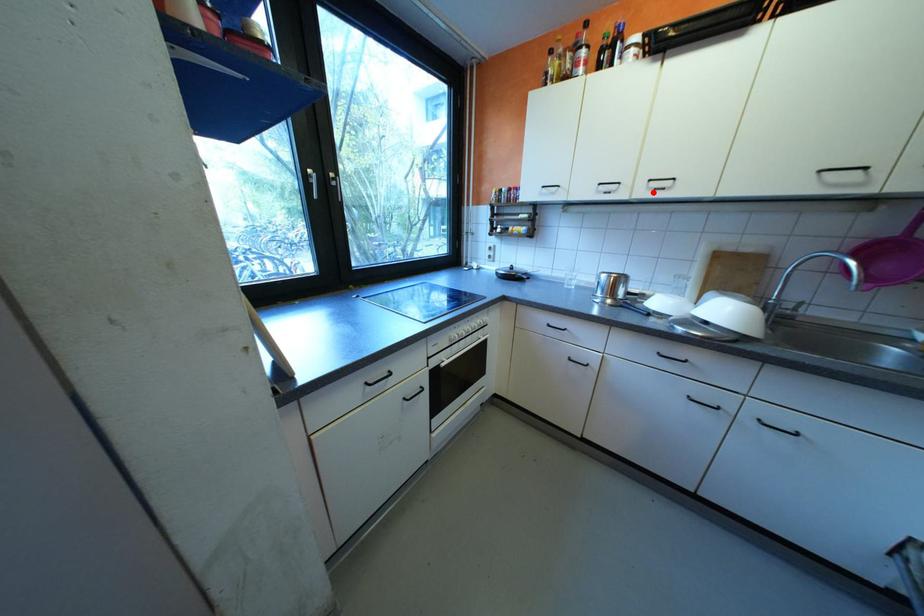
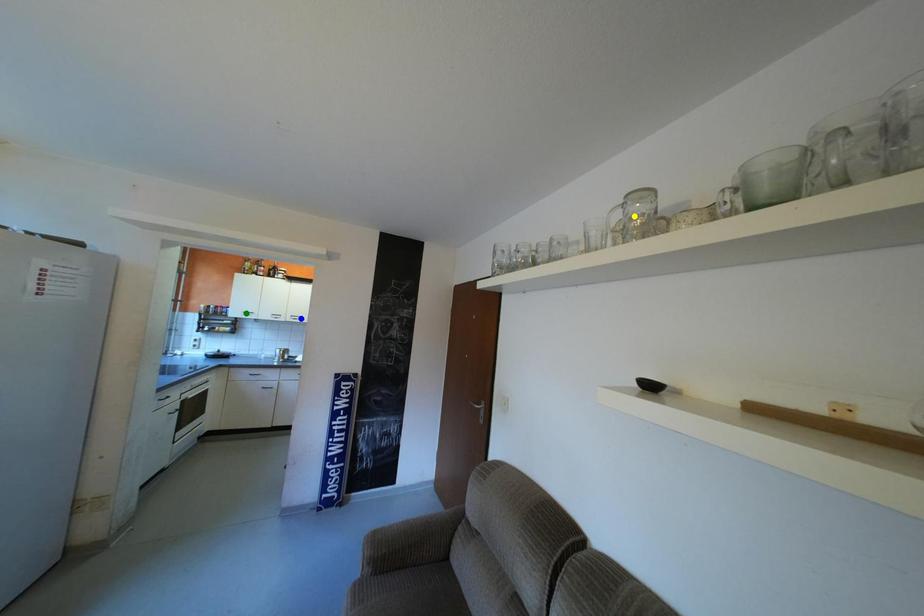
Question: I am providing you with two images of the same scene from different viewpoints. A red point is marked on the first image. You are given multiple points on the second image. Can you choose the point in image 2 that corresponds to the point in image 1?

Choices:
 (A) green point
 (B) yellow point
 (C) blue point

Answer: (C)